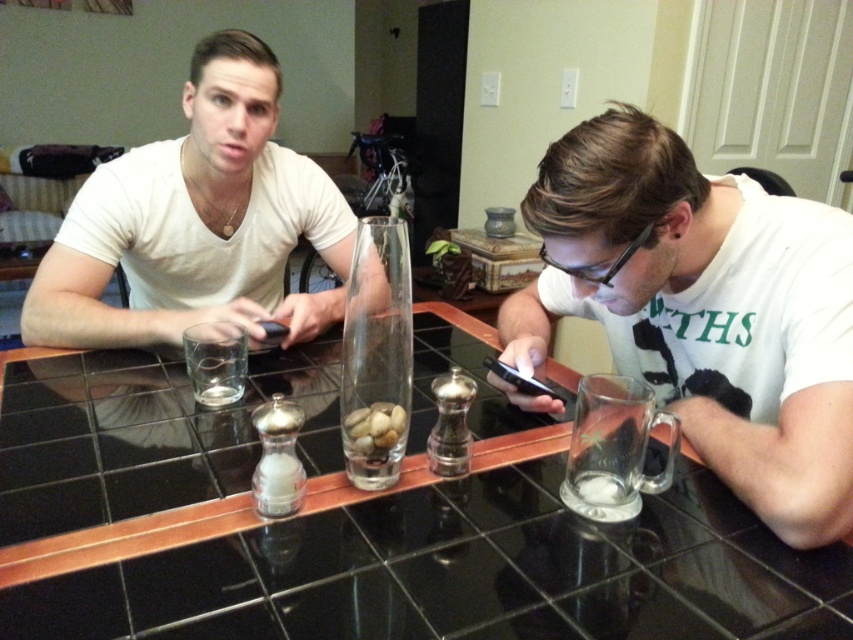
Is point (753, 394) positioned before point (325, 220)?

That is True.

Is the position of clear glass mug at right more distant than that of white matte shirt at upper left?

That is False.

What do you see at coordinates (703, 308) in the screenshot? I see `clear glass mug at right` at bounding box center [703, 308].

Where is `clear glass mug at right`? clear glass mug at right is located at coordinates pos(703,308).

Is black glass table at center shorter than clear glass mug at right?

Indeed, black glass table at center has a lesser height compared to clear glass mug at right.

Is black glass table at center smaller than clear glass mug at right?

Actually, black glass table at center might be larger than clear glass mug at right.

Who is more distant from viewer, (20, 541) or (720, 289)?

The point (720, 289) is behind.

The height and width of the screenshot is (640, 853). I want to click on black glass table at center, so click(358, 522).

Is black glass table at center below white matte shirt at upper left?

Yes.

What do you see at coordinates (358, 522) in the screenshot? This screenshot has height=640, width=853. I see `black glass table at center` at bounding box center [358, 522].

Locate an element on the screen. The height and width of the screenshot is (640, 853). black glass table at center is located at coordinates (358, 522).